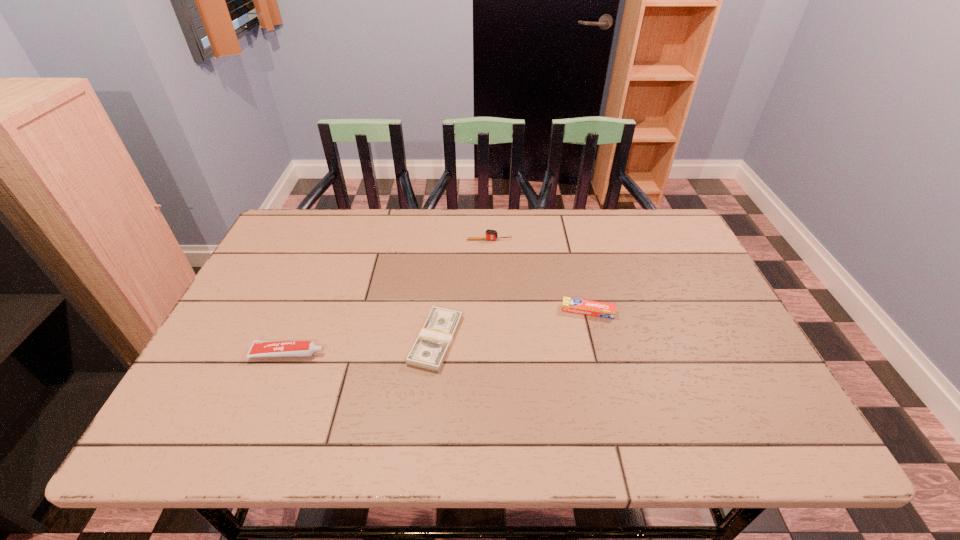
This screenshot has width=960, height=540. I want to click on vacant space located on the left of the farther toothpaste, so click(468, 311).

Where is `free space located on the back of the third object from right to left`? The width and height of the screenshot is (960, 540). free space located on the back of the third object from right to left is located at coordinates (446, 231).

The width and height of the screenshot is (960, 540). What are the coordinates of `object located in the far edge section of the desktop` in the screenshot? It's located at (490, 234).

In order to click on object that is positioned at the left edge in this screenshot , I will do point(259,348).

Identify the location of vacant space at the far edge. (558, 230).

This screenshot has width=960, height=540. In the image, there is a desktop. Identify the location of vacant space at the near edge. (515, 424).

This screenshot has width=960, height=540. In the image, there is a desktop. In order to click on vacant space at the left edge in this screenshot , I will do `click(215, 340)`.

The width and height of the screenshot is (960, 540). Identify the location of vacant space at the right edge of the desktop. (717, 401).

At what (x,y) coordinates should I click in order to perform the action: click on free region at the far left corner. Please return your answer as a coordinate pair (x, y). This screenshot has width=960, height=540. Looking at the image, I should click on (310, 224).

The image size is (960, 540). In the image, there is a desktop. Find the location of `vacant space at the far right corner`. vacant space at the far right corner is located at coordinates (644, 232).